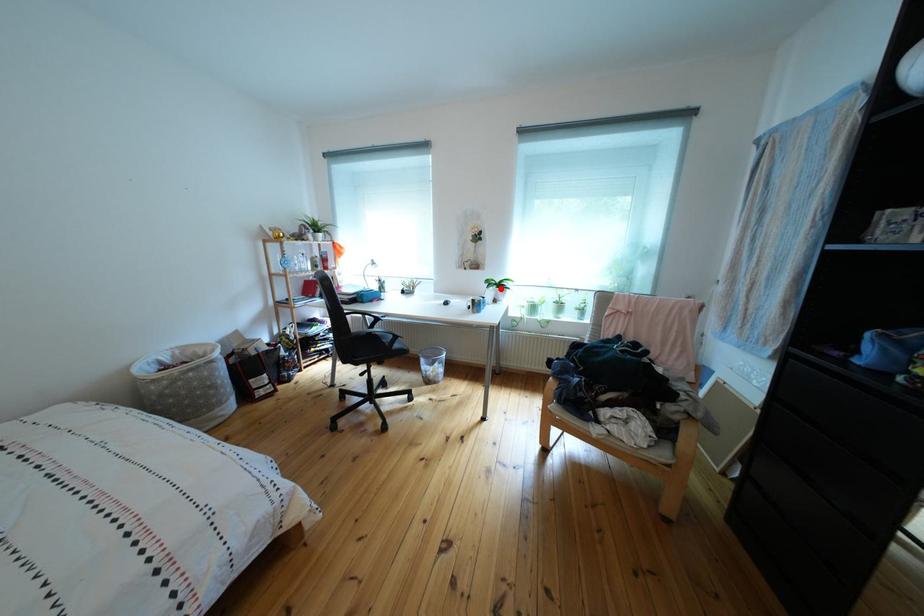
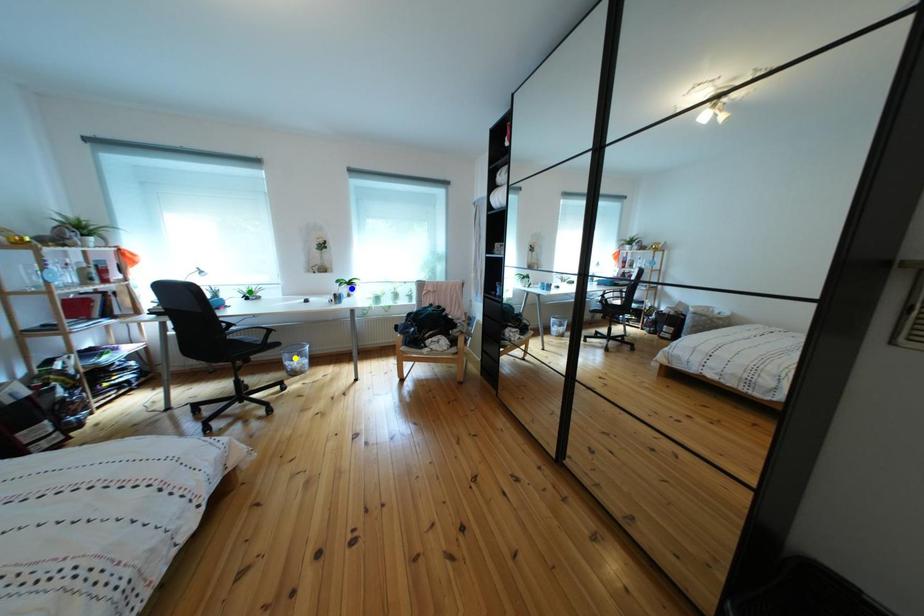
Question: I am providing you with two images of the same scene from different viewpoints. A red point is marked on the first image. You are given multiple points on the second image. Which spot in image 2 lines up with the point in image 1?

Choices:
 (A) yellow point
 (B) green point
 (C) blue point

Answer: (C)